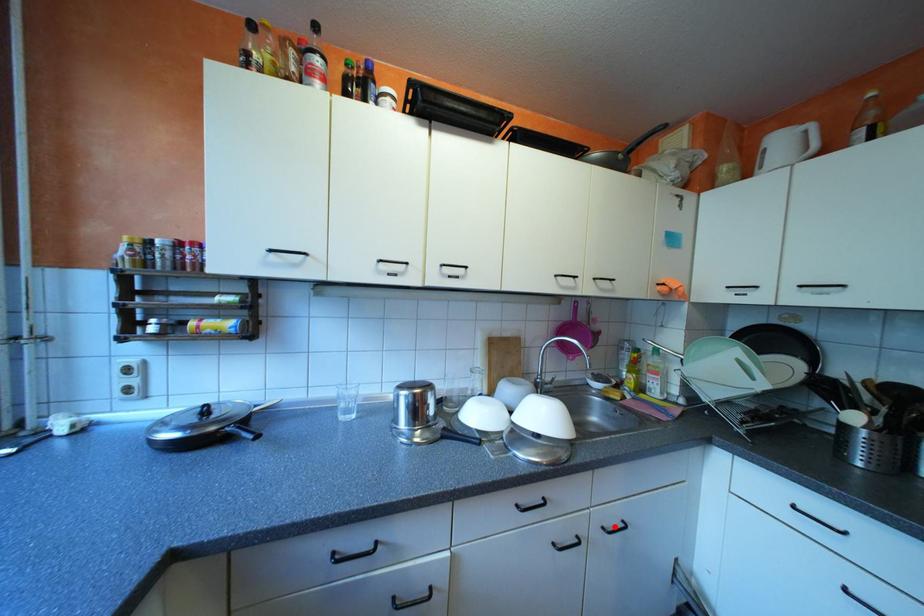
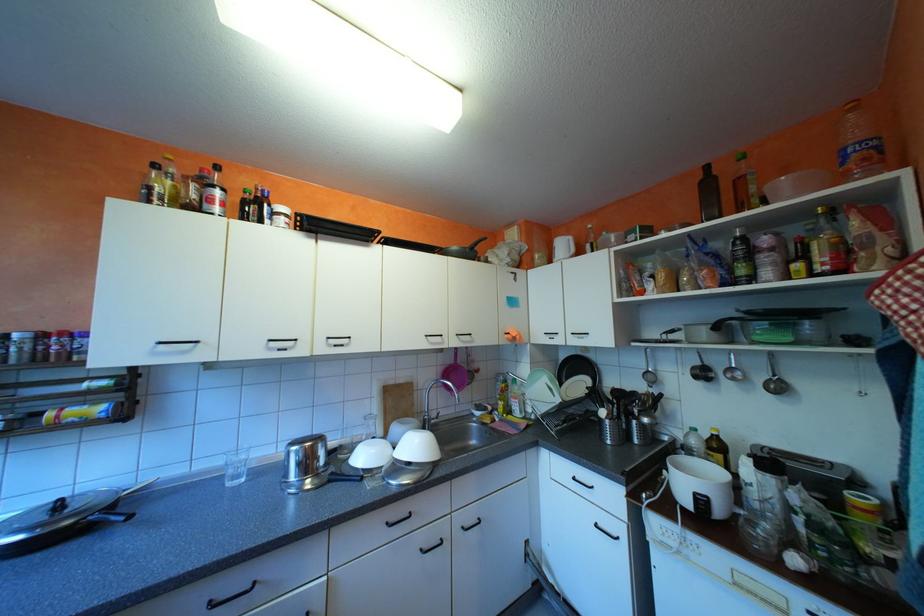
Find the pixel in the second image that matches the highlighted location in the first image.

(475, 527)